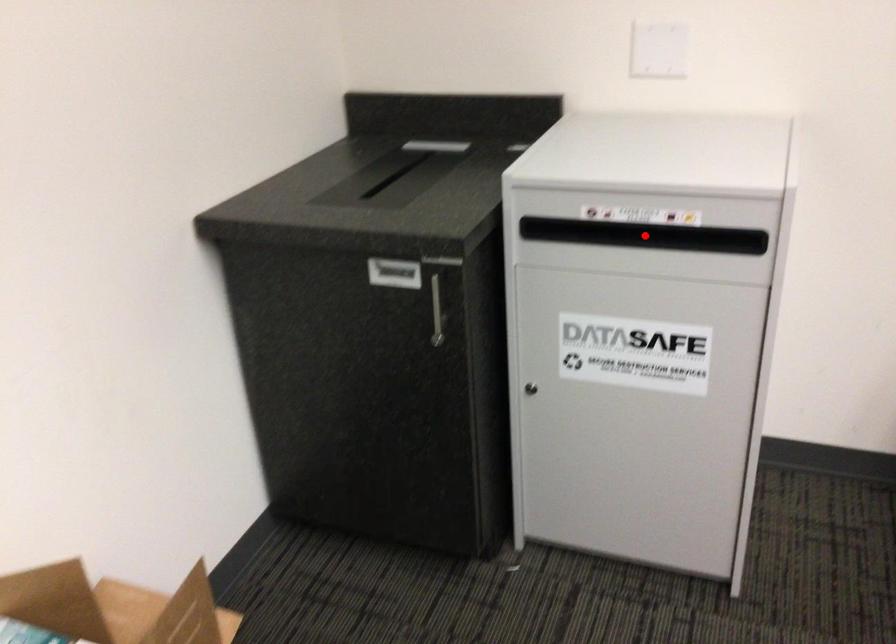
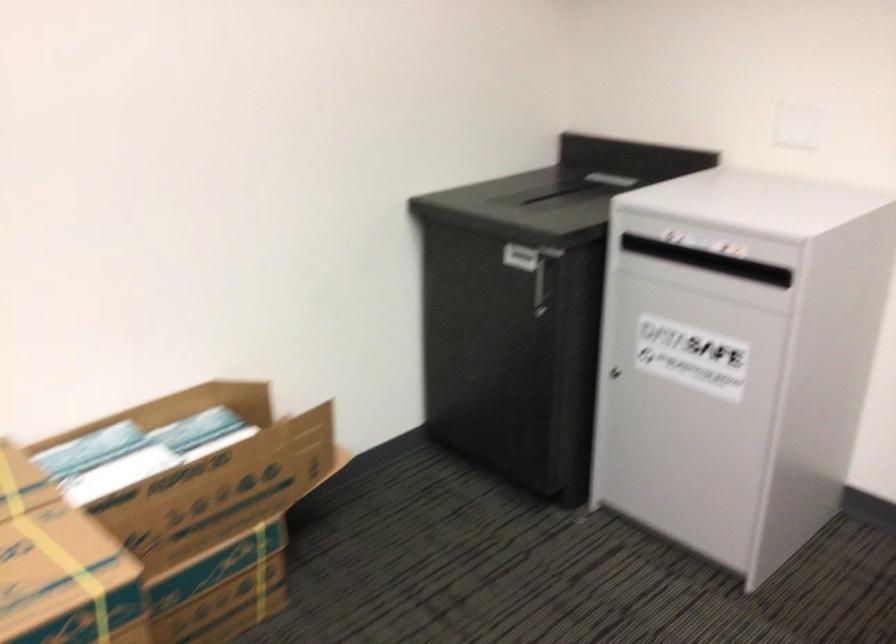
Question: I am providing you with two images of the same scene from different viewpoints. A red point is marked on the first image. At the location where the point appears in image 1, is it still visible in image 2?

Choices:
 (A) Yes
 (B) No

Answer: (B)